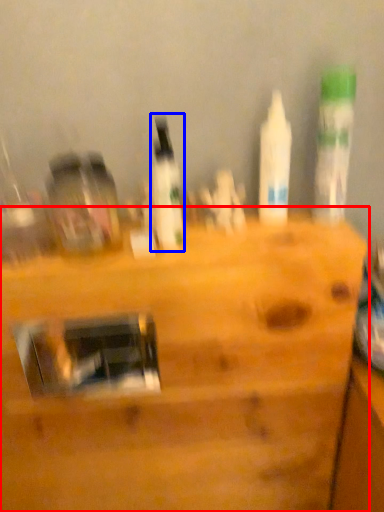
Question: Which object appears farthest to the camera in this image, furniture (highlighted by a red box) or bottle (highlighted by a blue box)?

Choices:
 (A) furniture
 (B) bottle

Answer: (A)